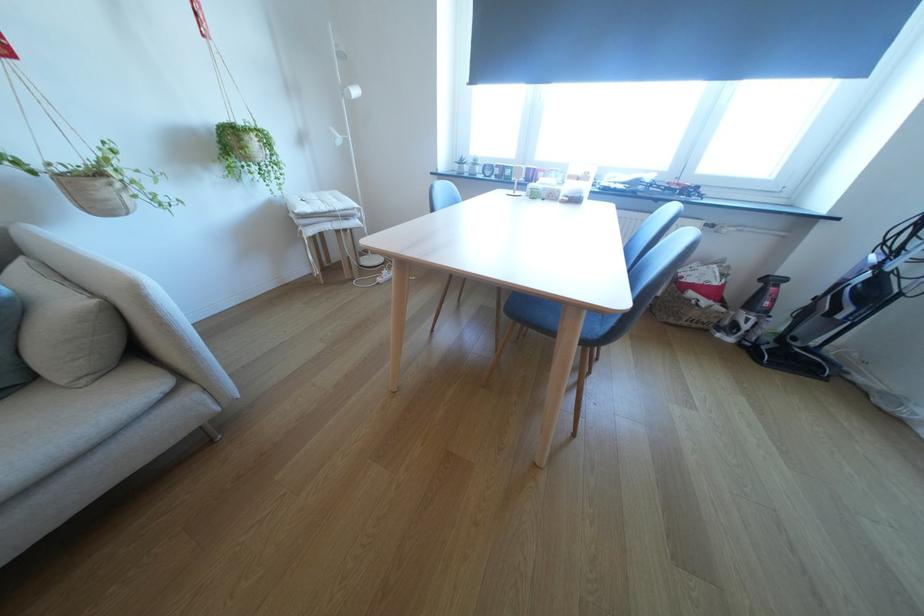
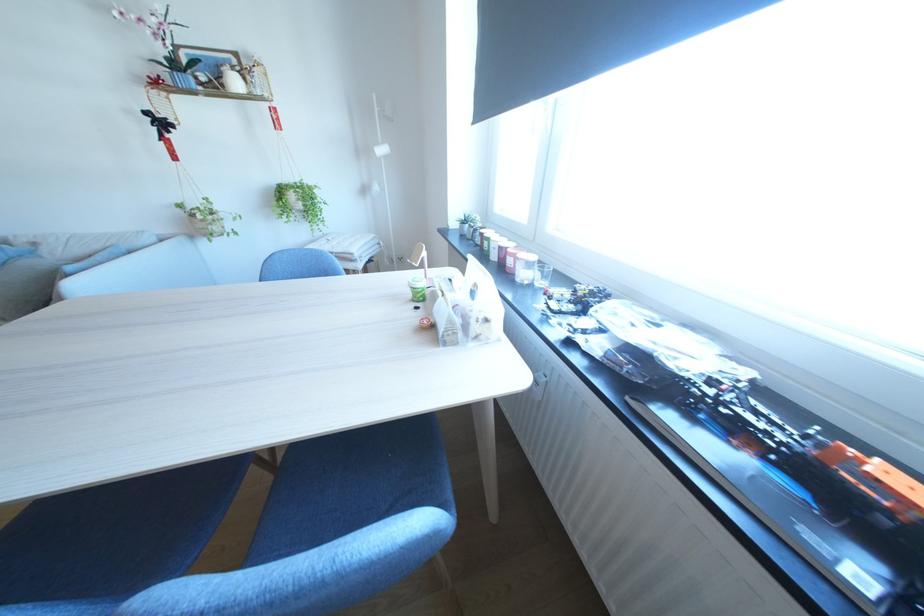
Find the pixel in the second image that matches point 550,174 in the first image.

(518, 257)